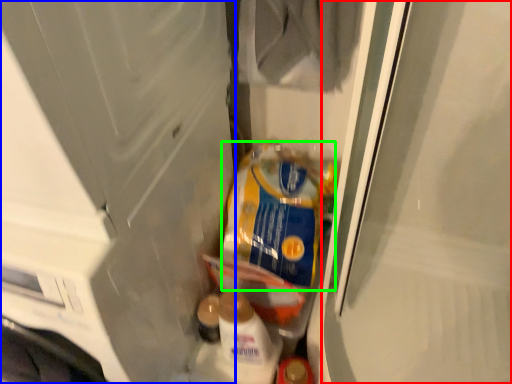
Question: Which object is the closest to the screen door (highlighted by a red box)? Choose among these: screen door (highlighted by a blue box) or product (highlighted by a green box).

Choices:
 (A) screen door
 (B) product

Answer: (B)